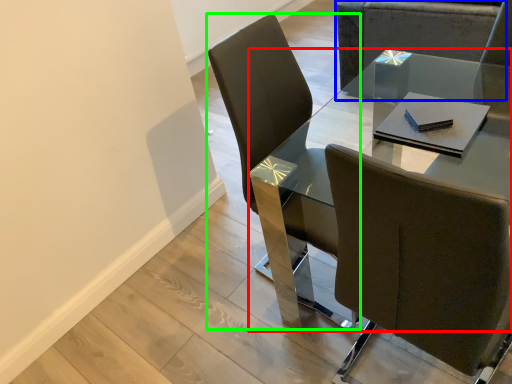
Question: Based on their relative distances, which object is farther from table (highlighted by a red box)? Choose from chair (highlighted by a blue box) and chair (highlighted by a green box).

Choices:
 (A) chair
 (B) chair

Answer: (B)